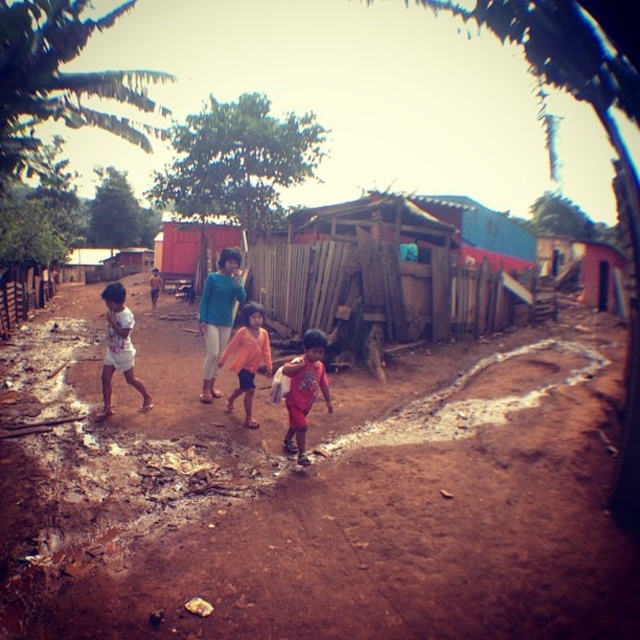
You are a photographer standing at the center of the dirt path in the rural village scene. You notice a red matte shirt at center. Can you confirm if the red matte shirt at center is located exactly at the point with coordinates (305, 390)?

Yes, the red matte shirt at center is located exactly at point (305, 390).